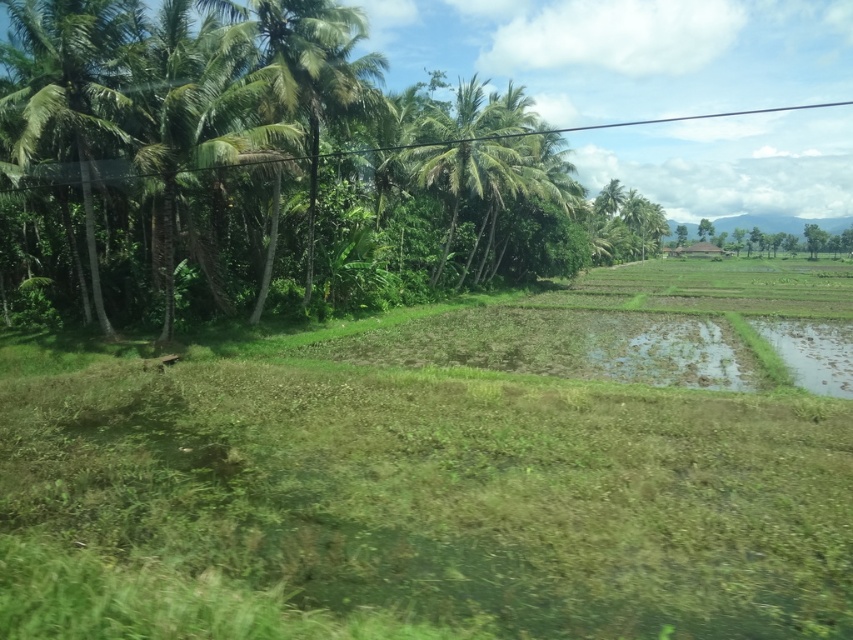
Question: Which of the following is the farthest from the observer?

Choices:
 (A) (430, 157)
 (B) (47, 83)

Answer: (A)

Question: Can you confirm if green leafy palm tree at left is smaller than green leafy palm tree at center?

Choices:
 (A) no
 (B) yes

Answer: (B)

Question: Which point is farther to the camera?

Choices:
 (A) green leafy palm tree at left
 (B) green leafy palm tree at center

Answer: (B)

Question: Is green leafy palm tree at left positioned in front of green leafy palm tree at center?

Choices:
 (A) yes
 (B) no

Answer: (A)

Question: Among these points, which one is nearest to the camera?

Choices:
 (A) (85, 141)
 (B) (502, 132)

Answer: (A)

Question: Can you confirm if green leafy palm tree at left is positioned above green leafy palm tree at center?

Choices:
 (A) yes
 (B) no

Answer: (B)